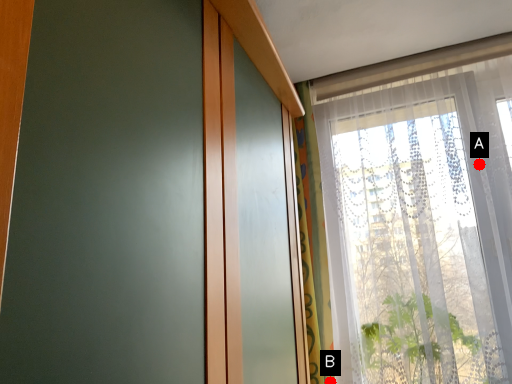
Question: Two points are circled on the image, labeled by A and B beside each circle. Among these points, which one is farthest from the camera?

Choices:
 (A) A is further
 (B) B is further

Answer: (A)